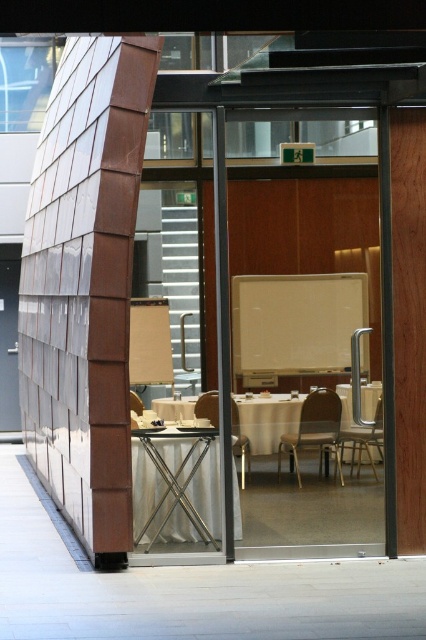
Looking at this image, you are a delivery person carrying a package that is 36 inches long. You need to move through the space between the transparent glass door at center and the metallic silver table at lower center. Can you fit through the space with the package?

The space between the transparent glass door at center and the metallic silver table at lower center is 35.33 inches. Since the package is 36 inches long, it is slightly longer than the available space. Therefore, you cannot fit through the space with the package.

You are a person who is 1.8 meters tall. You want to sit between the metallic silver chair at center and the brown leather chair at center. Is there enough space for you to sit comfortably between them?

The distance between the metallic silver chair at center and the brown leather chair at center is 1.72 meters. Since you are 1.8 meters tall, the space between them is slightly shorter than your height, so it might be tight but possible to sit between them.